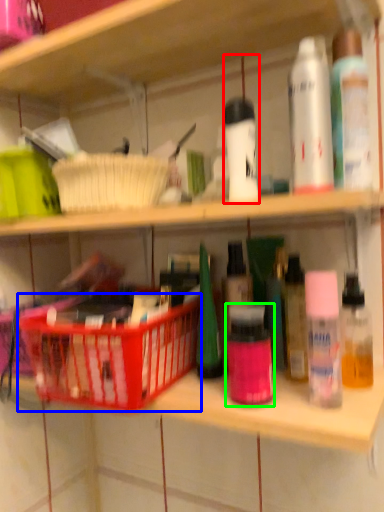
Question: Which object is positioned closest to toiletry (highlighted by a red box)? Select from basket (highlighted by a blue box) and toiletry (highlighted by a green box).

Choices:
 (A) basket
 (B) toiletry

Answer: (B)